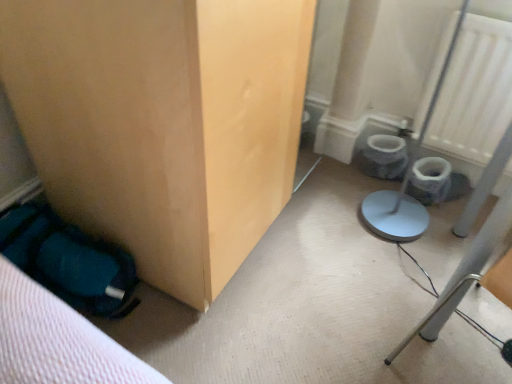
Question: From the image's perspective, is white textured radiator at upper right located above matte wood cabinet at lower left?

Choices:
 (A) no
 (B) yes

Answer: (B)

Question: Can you confirm if white textured radiator at upper right is wider than matte wood cabinet at lower left?

Choices:
 (A) no
 (B) yes

Answer: (A)

Question: From a real-world perspective, is white textured radiator at upper right under matte wood cabinet at lower left?

Choices:
 (A) yes
 (B) no

Answer: (A)

Question: Is white textured radiator at upper right smaller than matte wood cabinet at lower left?

Choices:
 (A) no
 (B) yes

Answer: (B)

Question: From the image's perspective, is white textured radiator at upper right under matte wood cabinet at lower left?

Choices:
 (A) no
 (B) yes

Answer: (A)

Question: Does white textured radiator at upper right lie behind matte wood cabinet at lower left?

Choices:
 (A) no
 (B) yes

Answer: (B)

Question: From a real-world perspective, is matte wood cabinet at lower left located beneath white textured radiator at upper right?

Choices:
 (A) no
 (B) yes

Answer: (A)

Question: Is matte wood cabinet at lower left shorter than white textured radiator at upper right?

Choices:
 (A) yes
 (B) no

Answer: (B)

Question: Is matte wood cabinet at lower left thinner than white textured radiator at upper right?

Choices:
 (A) yes
 (B) no

Answer: (B)

Question: Does matte wood cabinet at lower left lie in front of white textured radiator at upper right?

Choices:
 (A) no
 (B) yes

Answer: (B)

Question: Is matte wood cabinet at lower left to the right of white textured radiator at upper right from the viewer's perspective?

Choices:
 (A) no
 (B) yes

Answer: (A)

Question: Would you say matte wood cabinet at lower left is outside white textured radiator at upper right?

Choices:
 (A) no
 (B) yes

Answer: (B)

Question: From a real-world perspective, is matte wood cabinet at lower left above or below white textured radiator at upper right?

Choices:
 (A) above
 (B) below

Answer: (A)